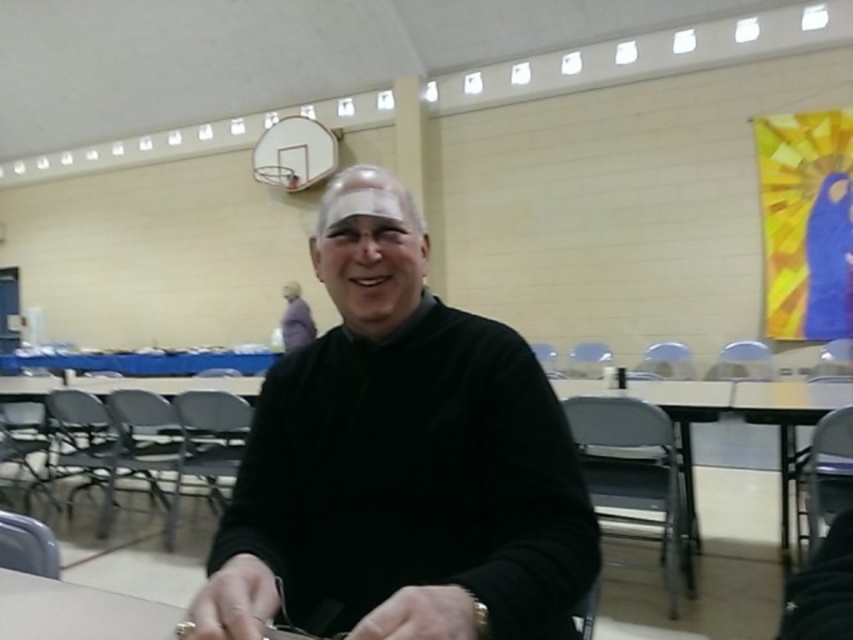
Can you confirm if black matte sweater at center is wider than black plastic table at center?

Incorrect, black matte sweater at center's width does not surpass black plastic table at center's.

The image size is (853, 640). I want to click on black matte sweater at center, so click(399, 461).

Who is shorter, black matte sweater at center or smooth plastic table at center?

Standing shorter between the two is black matte sweater at center.

Between black matte sweater at center and smooth plastic table at center, which one is positioned lower?

Positioned lower is smooth plastic table at center.

Who is more distant from viewer, (500,481) or (772,410)?

The point (772,410) is behind.

Find the location of a particular element. The height and width of the screenshot is (640, 853). black matte sweater at center is located at coordinates (399, 461).

Can you confirm if black plastic table at center is positioned to the left of smooth plastic table at center?

Correct, you'll find black plastic table at center to the left of smooth plastic table at center.

Which of these two, black plastic table at center or smooth plastic table at center, stands taller?

Standing taller between the two is black plastic table at center.

Image resolution: width=853 pixels, height=640 pixels. In order to click on black plastic table at center in this screenshot , I will do `click(674, 422)`.